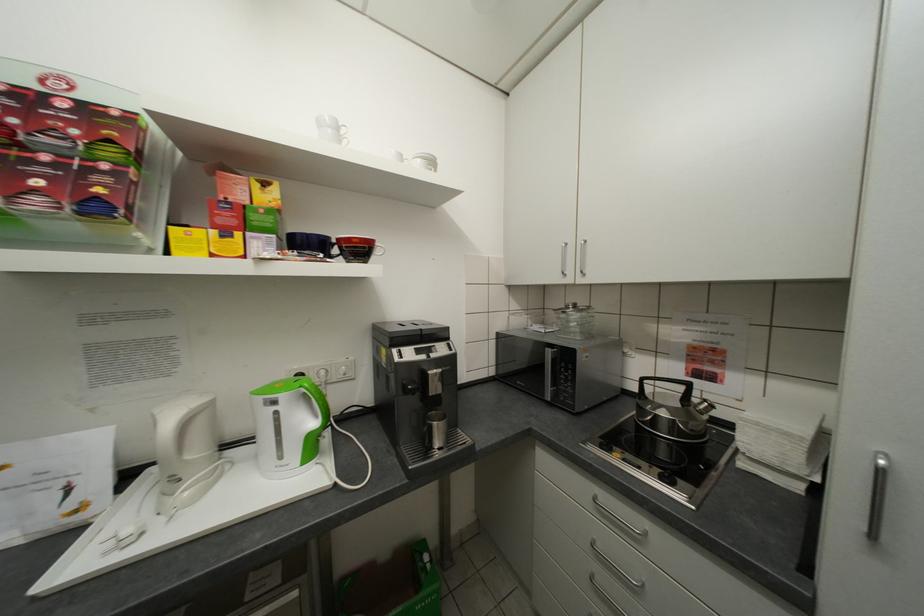
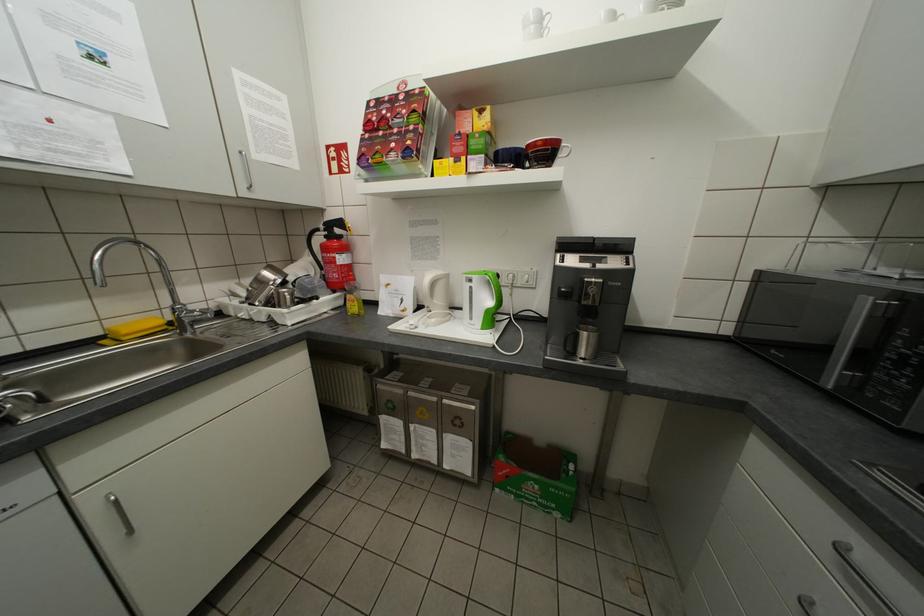
Find the pixel in the second image that matches point 409,158 in the first image.

(623, 17)